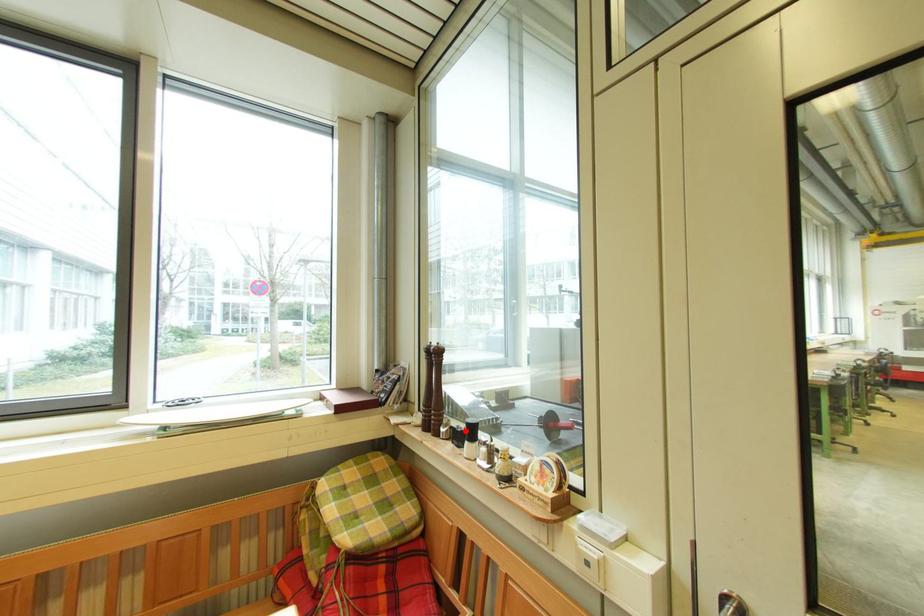
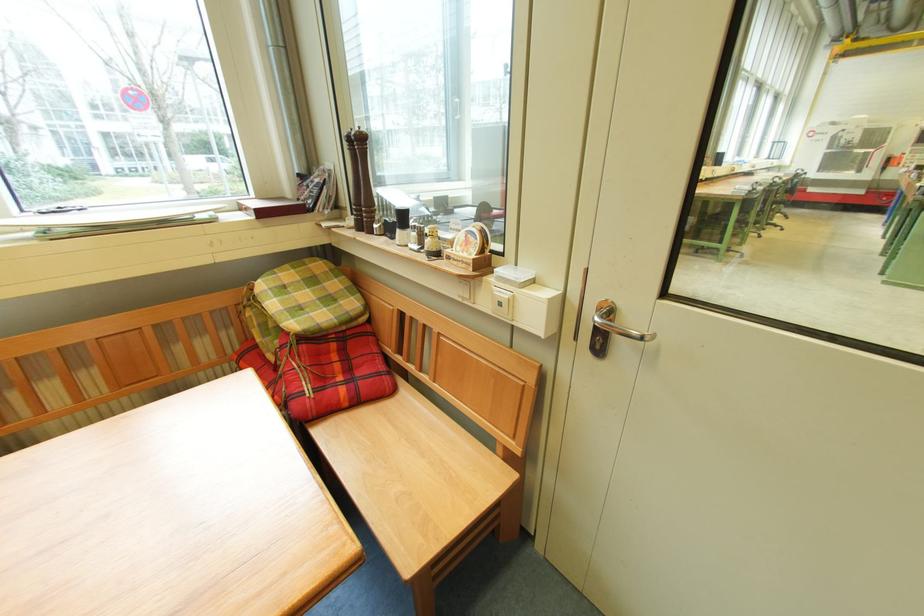
Find the pixel in the second image that matches the highlighted location in the first image.

(397, 224)